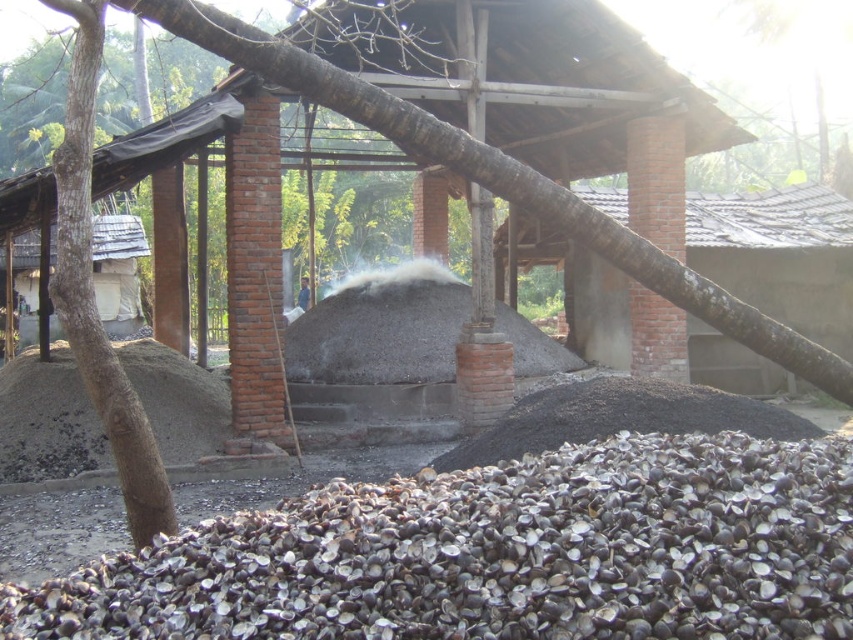
Question: Among these objects, which one is nearest to the camera?

Choices:
 (A) gray concrete mound at center
 (B) black gravel at lower center
 (C) black gravel pile at lower right

Answer: (B)

Question: Based on their relative distances, which object is nearer to the black gravel pile at lower right?

Choices:
 (A) black gravel at lower center
 (B) gray concrete mound at center

Answer: (A)

Question: Among these objects, which one is nearest to the camera?

Choices:
 (A) black gravel pile at lower right
 (B) gray concrete mound at center
 (C) black gravel at lower center

Answer: (C)

Question: Can you confirm if black gravel at lower center is wider than black gravel pile at lower right?

Choices:
 (A) no
 (B) yes

Answer: (B)

Question: Is black gravel at lower center to the left of gray concrete mound at center from the viewer's perspective?

Choices:
 (A) yes
 (B) no

Answer: (B)

Question: Can you confirm if black gravel at lower center is positioned above black gravel pile at lower right?

Choices:
 (A) yes
 (B) no

Answer: (B)